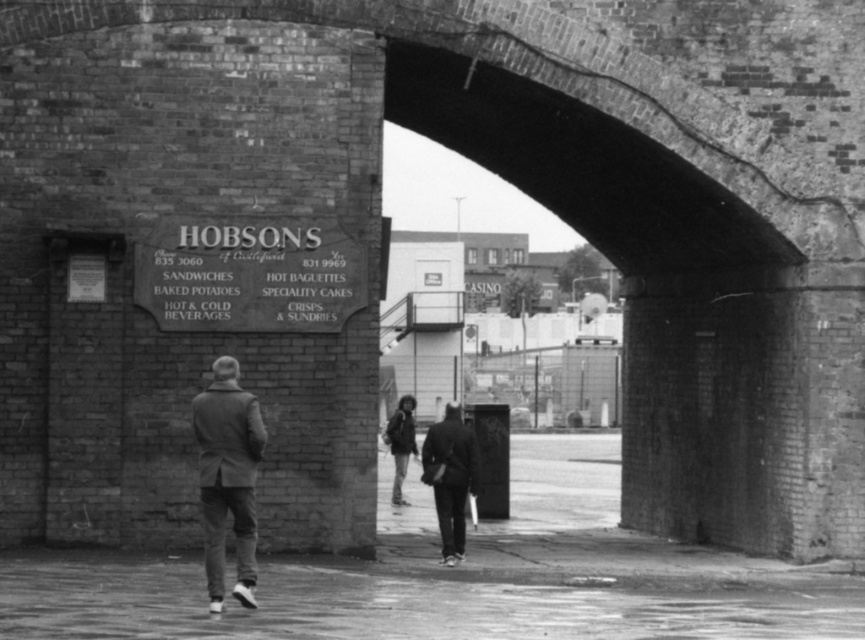
Who is higher up, dark fabric jacket at center or dark gray fabric jacket at center?

dark fabric jacket at center is higher up.

Can you confirm if dark fabric jacket at center is positioned above dark gray fabric jacket at center?

Indeed, dark fabric jacket at center is positioned over dark gray fabric jacket at center.

Between point (431, 481) and point (400, 397), which one is positioned behind?

The point (400, 397) is behind.

I want to click on dark fabric jacket at center, so click(x=450, y=477).

Does dark gray wool coat at center appear under dark fabric jacket at center?

No.

Is point (210, 474) closer to viewer compared to point (439, 448)?

Yes, point (210, 474) is closer to viewer.

The width and height of the screenshot is (865, 640). What are the coordinates of `dark gray wool coat at center` in the screenshot? It's located at (227, 477).

Looking at this image, does dark gray wool coat at center come behind dark gray fabric jacket at center?

No, dark gray wool coat at center is closer to the viewer.

Between point (213, 602) and point (388, 435), which one is positioned in front?

Point (213, 602) is more forward.

What are the coordinates of `dark gray wool coat at center` in the screenshot? It's located at (227, 477).